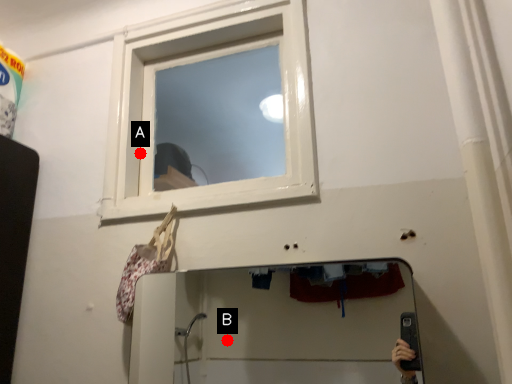
Question: Two points are circled on the image, labeled by A and B beside each circle. Which point is farther to the camera?

Choices:
 (A) A is further
 (B) B is further

Answer: (B)